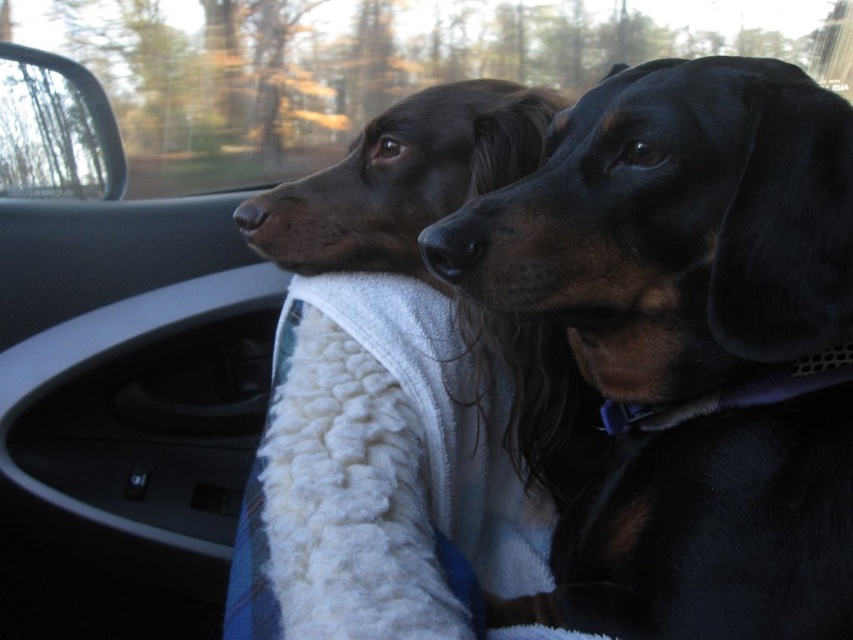
Between point (827, 396) and point (1, 88), which one is positioned in front?

Positioned in front is point (827, 396).

Is black smooth dog at center taller than transparent glass car window at upper left?

Correct, black smooth dog at center is much taller as transparent glass car window at upper left.

You are a GUI agent. You are given a task and a screenshot of the screen. Output one action in this format:
    pyautogui.click(x=<x>, y=<y>)
    Task: Click on the black smooth dog at center
    The image size is (853, 640).
    Given the screenshot: What is the action you would take?
    pyautogui.click(x=688, y=344)

Find the location of a particular element. black smooth dog at center is located at coordinates (688, 344).

Can you confirm if shiny brown dog at center is taller than transparent glass car window at upper left?

Correct, shiny brown dog at center is much taller as transparent glass car window at upper left.

Where is `shiny brown dog at center`? This screenshot has width=853, height=640. shiny brown dog at center is located at coordinates (401, 179).

Between black smooth dog at center and shiny brown dog at center, which one has less height?

Standing shorter between the two is shiny brown dog at center.

From the picture: Which is below, black smooth dog at center or shiny brown dog at center?

black smooth dog at center is lower down.

Where is `black smooth dog at center`? The image size is (853, 640). black smooth dog at center is located at coordinates (688, 344).

This screenshot has width=853, height=640. Identify the location of black smooth dog at center. (688, 344).